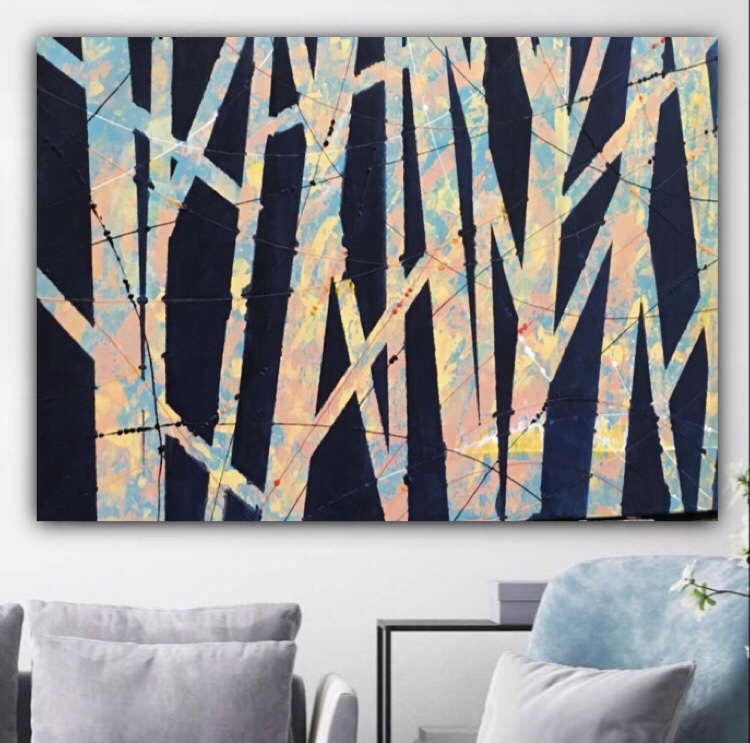
Find the location of a particular element. table is located at coordinates (398, 623).